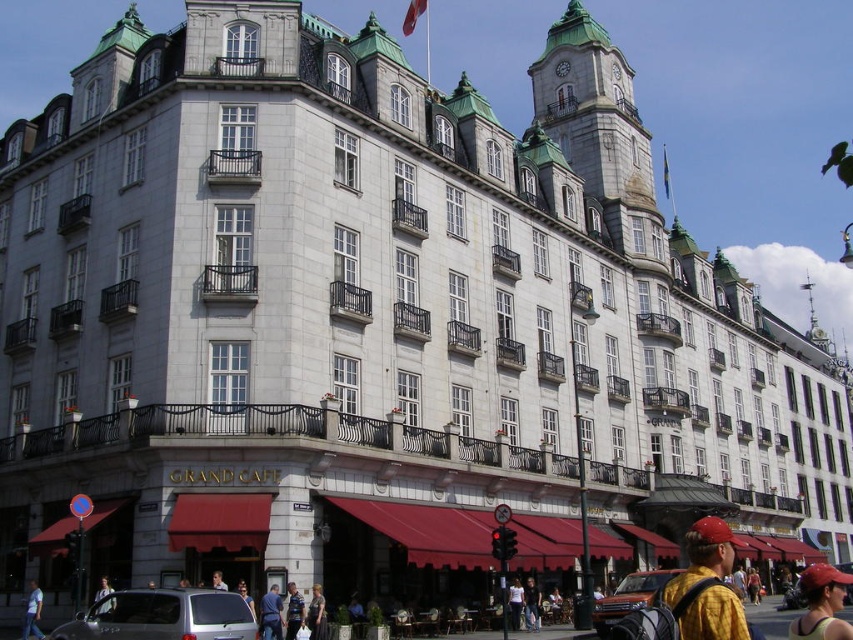
Question: Is denim jacket at lower center to the right of denim jacket at lower right from the viewer's perspective?

Choices:
 (A) yes
 (B) no

Answer: (B)

Question: Can you confirm if light brown leather jacket at lower center is positioned above light brown leather jacket at center?

Choices:
 (A) no
 (B) yes

Answer: (A)

Question: Is orange matte suv at center to the right of blue fabric flag at upper center from the viewer's perspective?

Choices:
 (A) no
 (B) yes

Answer: (A)

Question: Based on their relative distances, which object is farther from the yellow fabric cap at lower right?

Choices:
 (A) light brown leather jacket at lower left
 (B) blue fabric shirt at center
 (C) white cotton shirt at center
 (D) light brown leather jacket at lower center

Answer: (A)

Question: Considering the real-world distances, which object is farthest from the light blue denim jeans at lower left?

Choices:
 (A) orange matte suv at center
 (B) yellow matte shirt at lower right
 (C) red fabric flag at upper center
 (D) dark gray fabric shirt at center

Answer: (C)

Question: Which of the following is the closest to the observer?

Choices:
 (A) orange matte suv at center
 (B) light brown leather jacket at lower center

Answer: (B)